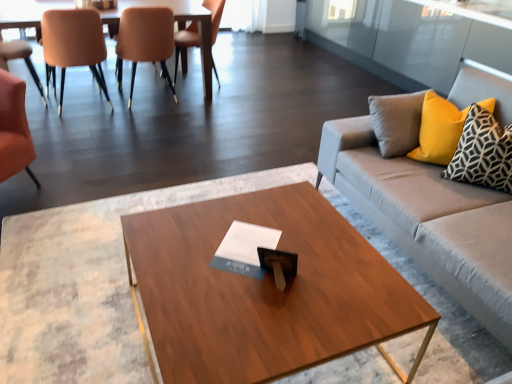
I want to click on vacant area that is in front of matte orange chair at left, which is the third chair from right to left, so click(78, 125).